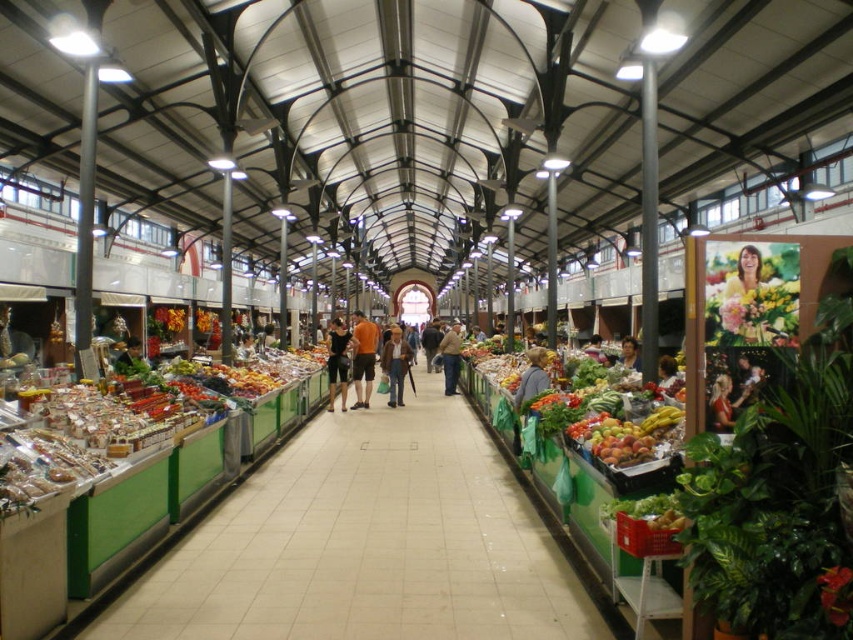
From the picture: You are navigating through the market and need to reach a specific location. You are currently at point (450, 360). There is another point at (741, 252). Which point is closer to you?

Point (741, 252) is in front of point (450, 360), so the closer point to you is point (741, 252).

You are a customer in the market and want to grab both the green plastic produce at center and the smooth yellow hair at center. Which one should you reach for first if you want to pick up the item that is closer to your left side?

The green plastic produce at center is positioned on the left side of smooth yellow hair at center, so you should reach for the green plastic produce at center first as it is closer to your left side.

You are a customer in the market and want to locate the smooth yellow hair at center and denim jacket at center. Which one is positioned higher from the ground?

The smooth yellow hair at center is above denim jacket at center, so the smooth yellow hair at center is higher from the ground.